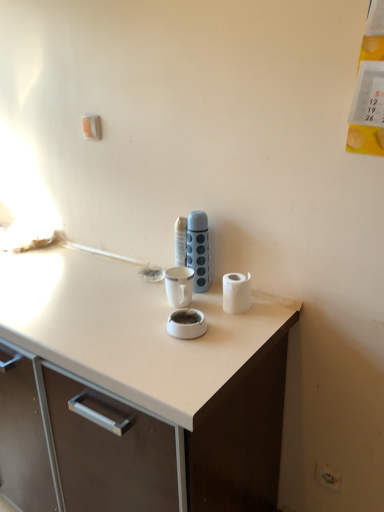
Question: Based on their positions, is white matte paper towel at right located to the left or right of blue textured thermos at center?

Choices:
 (A) left
 (B) right

Answer: (B)

Question: From a real-world perspective, is white matte paper towel at right above or below blue textured thermos at center?

Choices:
 (A) below
 (B) above

Answer: (A)

Question: Which of these objects is positioned farthest from the white matte paper towel at right?

Choices:
 (A) white plastic electric outlet at lower right
 (B) blue textured thermos at center

Answer: (A)

Question: Which of these objects is positioned farthest from the white matte paper towel at right?

Choices:
 (A) white plastic electric outlet at lower right
 (B) blue textured thermos at center

Answer: (A)